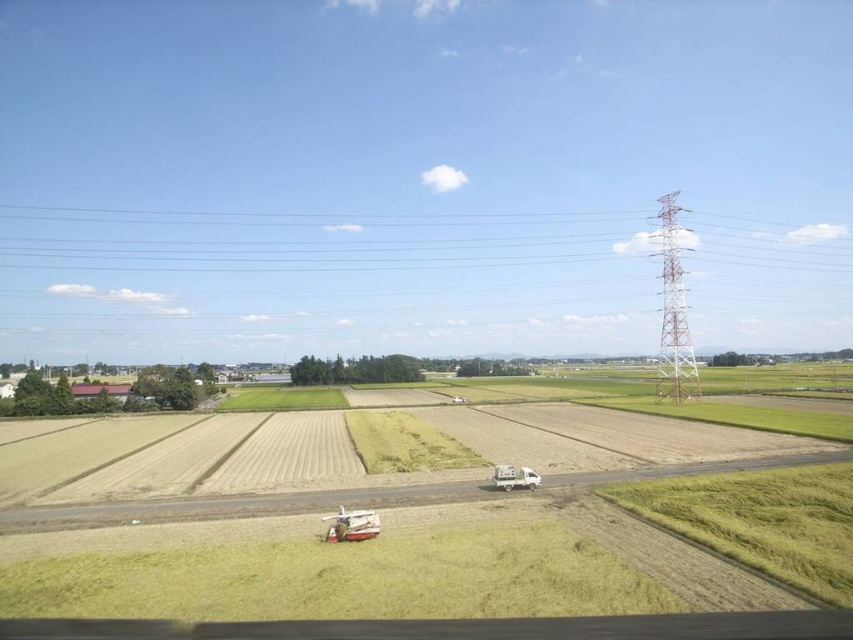
The height and width of the screenshot is (640, 853). Describe the element at coordinates (437, 529) in the screenshot. I see `green grassy field at center` at that location.

Is green grassy field at center bigger than smooth wire power line at upper center?

Incorrect, green grassy field at center is not larger than smooth wire power line at upper center.

Who is more distant from viewer, (404, 561) or (604, 253)?

The point (604, 253) is more distant.

This screenshot has width=853, height=640. I want to click on green grassy field at center, so click(x=437, y=529).

Between point (325, 470) and point (498, 484), which one is positioned in front?

Point (498, 484) is more forward.

Does green grassy field at center appear on the left side of white matte trailer truck at center?

No, green grassy field at center is not to the left of white matte trailer truck at center.

Is point (546, 417) positioned before point (521, 486)?

No, (546, 417) is further to viewer.

Identify the location of green grassy field at center. This screenshot has width=853, height=640. (437, 529).

Can you confirm if smooth wire power line at upper center is taller than white matte trailer truck at center?

Yes.

Can you confirm if smooth wire power line at upper center is positioned to the left of white matte trailer truck at center?

Indeed, smooth wire power line at upper center is positioned on the left side of white matte trailer truck at center.

This screenshot has height=640, width=853. Identify the location of smooth wire power line at upper center. (335, 237).